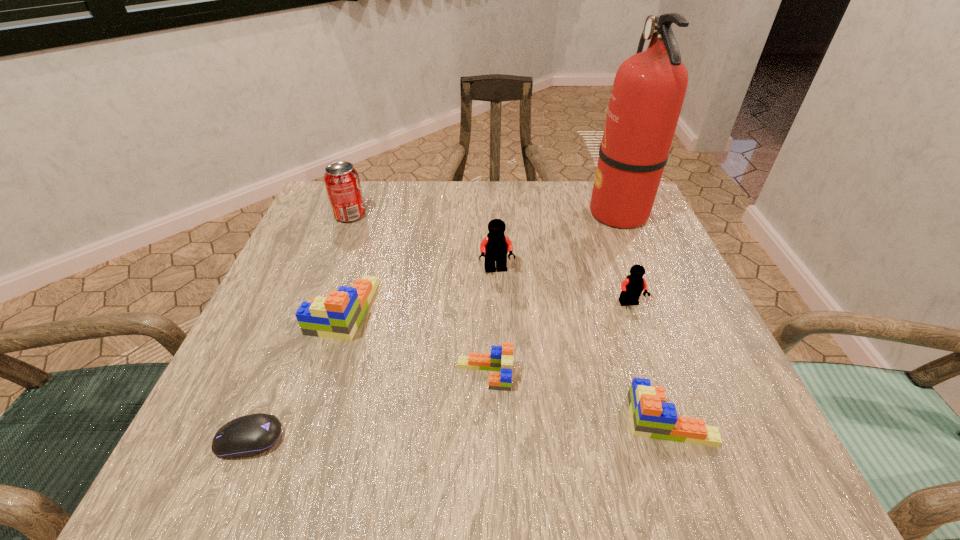
Find the location of a particular element. The image size is (960, 540). vacant point located 0.200m on the back of the leftmost orange Lego is located at coordinates (370, 225).

Find the location of a particular element. Image resolution: width=960 pixels, height=540 pixels. vacant region located 0.300m on the front-facing side of the nearer black Lego is located at coordinates (687, 469).

I want to click on vacant region located on the back of the sixth tallest object, so click(x=607, y=243).

You are a GUI agent. You are given a task and a screenshot of the screen. Output one action in this format:
    pyautogui.click(x=<x>, y=<y>)
    Task: Click on the blank space located 0.080m on the front of the sixth farthest object
    Image resolution: width=960 pixels, height=540 pixels.
    Given the screenshot: What is the action you would take?
    pyautogui.click(x=486, y=438)

The height and width of the screenshot is (540, 960). Find the location of `free space located 0.290m on the back of the shortest object`. free space located 0.290m on the back of the shortest object is located at coordinates (312, 287).

The image size is (960, 540). I want to click on fire extinguisher present at the far edge, so click(x=649, y=88).

The width and height of the screenshot is (960, 540). Find the location of `soda can that is positioned at the far edge`. soda can that is positioned at the far edge is located at coordinates (341, 179).

Where is `Lego located at the near edge`? Lego located at the near edge is located at coordinates (651, 417).

In order to click on computer mouse that is at the near edge in this screenshot , I will do `click(246, 436)`.

Find the location of `soda can located in the left edge section of the desktop`. soda can located in the left edge section of the desktop is located at coordinates (341, 179).